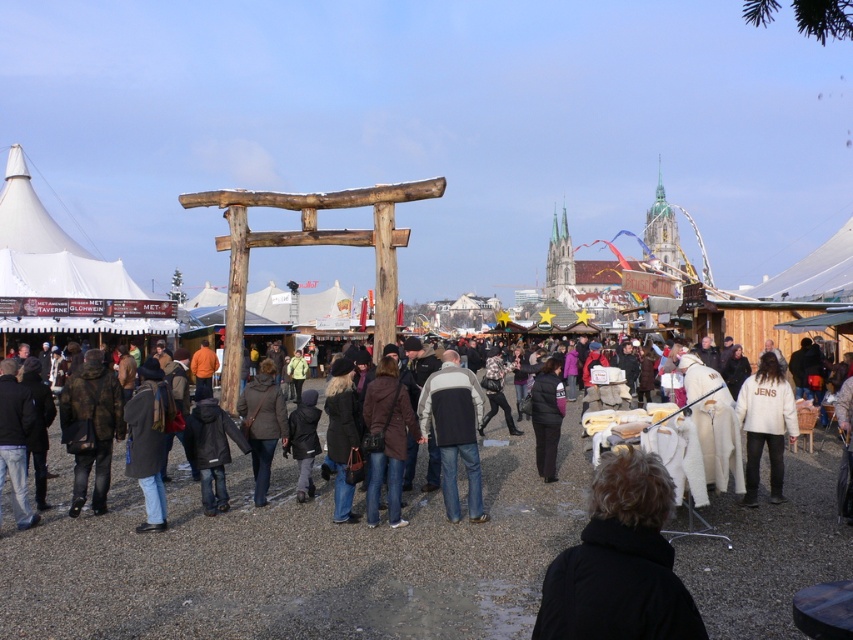
Question: Which of the following is the closest to the observer?

Choices:
 (A) (444, 378)
 (B) (689, 620)

Answer: (B)

Question: Can you confirm if black woolen coat at center is wider than white fleece jacket at right?

Choices:
 (A) no
 (B) yes

Answer: (B)

Question: Which of the following is the closest to the observer?

Choices:
 (A) (775, 372)
 (B) (476, 460)
 (C) (561, 416)
 (D) (653, 541)

Answer: (D)

Question: Does black woolen coat at center have a larger size compared to black matte coat at center?

Choices:
 (A) no
 (B) yes

Answer: (B)

Question: Among these objects, which one is farthest from the camera?

Choices:
 (A) white fleece jacket at right
 (B) black matte coat at center

Answer: (B)

Question: Does gray matte jacket at center have a larger size compared to black matte coat at center?

Choices:
 (A) yes
 (B) no

Answer: (A)